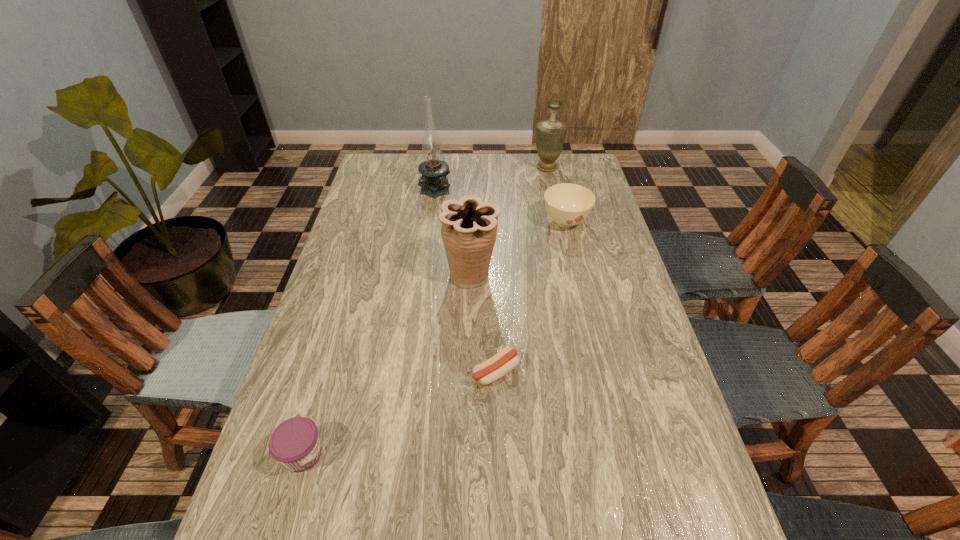
Where is `the second nearest object`? Image resolution: width=960 pixels, height=540 pixels. the second nearest object is located at coordinates (497, 366).

Find the location of a particular element. sausage is located at coordinates (497, 366).

Locate an element on the screen. The image size is (960, 540). free space located on the left of the oil lamp is located at coordinates (379, 187).

This screenshot has height=540, width=960. Identify the location of vacant region located on the back of the farthest object. coord(544,154).

The image size is (960, 540). I want to click on vacant position located on the right of the nearer urn, so click(x=522, y=275).

At what (x,y) coordinates should I click in order to perform the action: click on vacant space located on the left of the fourth nearest object. Please return your answer as a coordinate pair (x, y). The image size is (960, 540). Looking at the image, I should click on (527, 222).

Where is `free region located 0.250m on the front label of the nearest object`? Image resolution: width=960 pixels, height=540 pixels. free region located 0.250m on the front label of the nearest object is located at coordinates (444, 454).

At what (x,y) coordinates should I click in order to perform the action: click on vacant region located 0.120m on the left of the shortest object. Please return your answer as a coordinate pair (x, y). The image size is (960, 540). Looking at the image, I should click on (423, 372).

You are a GUI agent. You are given a task and a screenshot of the screen. Output one action in this format:
    pyautogui.click(x=<x>, y=<y>)
    Task: Click on the oil lamp that is positioned at the far edge
    The image size is (960, 540).
    Given the screenshot: What is the action you would take?
    pyautogui.click(x=434, y=183)

Find the location of `urn that is positioned at the far edge`. urn that is positioned at the far edge is located at coordinates (550, 134).